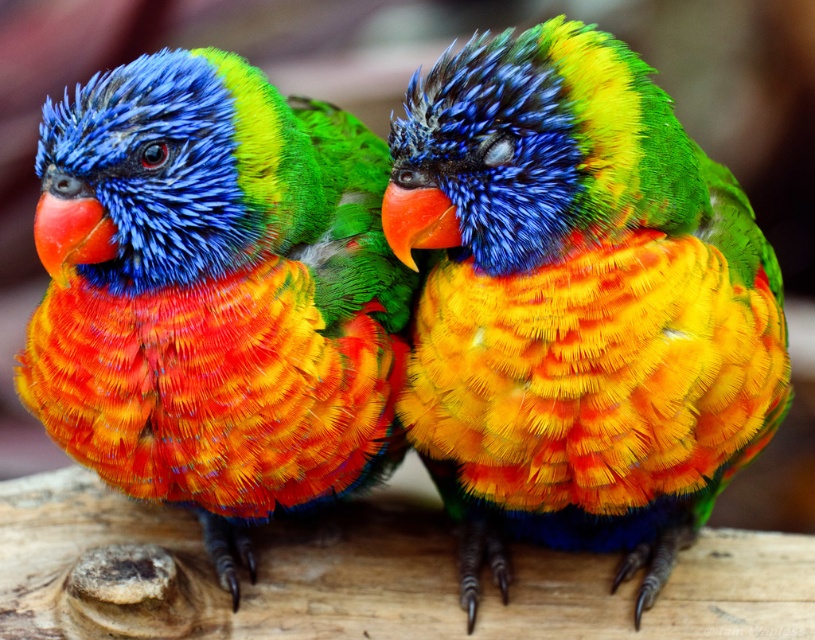
Question: Is shiny multicolored parrot at center positioned behind shiny multicolored parrot at left?

Choices:
 (A) yes
 (B) no

Answer: (A)

Question: Which point is closer to the camera taking this photo?

Choices:
 (A) click(x=357, y=365)
 (B) click(x=756, y=426)

Answer: (B)

Question: Among these points, which one is farthest from the camera?

Choices:
 (A) (576, 451)
 (B) (144, 83)

Answer: (A)

Question: Can you confirm if shiny multicolored parrot at center is positioned to the right of shiny multicolored parrot at left?

Choices:
 (A) no
 (B) yes

Answer: (B)

Question: Can you confirm if shiny multicolored parrot at center is smaller than shiny multicolored parrot at left?

Choices:
 (A) yes
 (B) no

Answer: (B)

Question: Among these points, which one is farthest from the camera?

Choices:
 (A) (249, 301)
 (B) (413, 209)

Answer: (A)